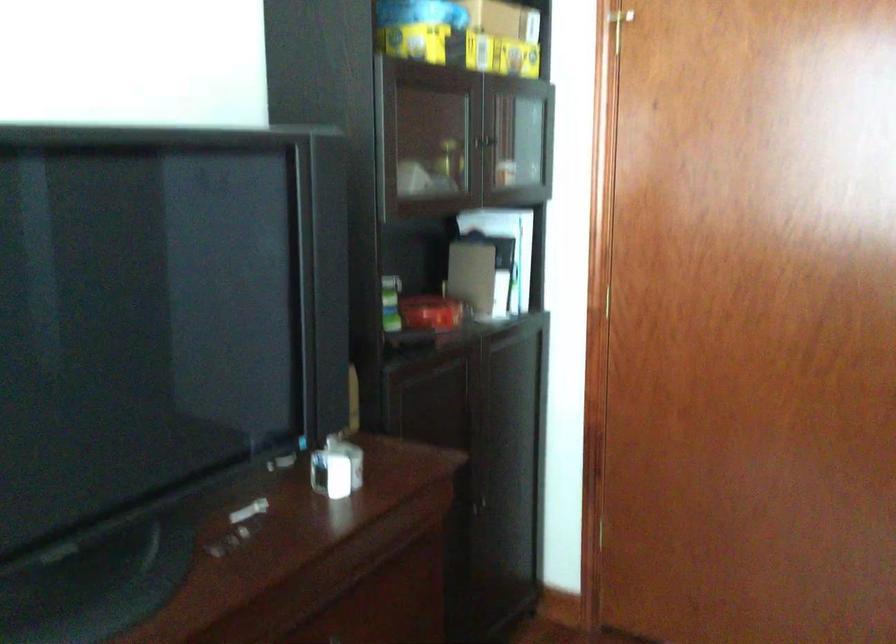
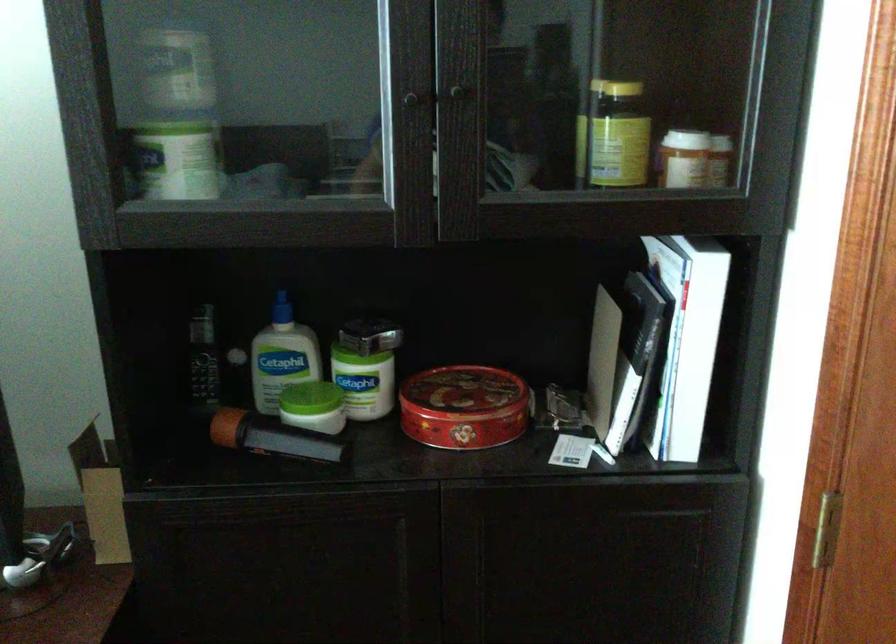
Find the pixel in the second image that matches [427,305] in the first image.

(462, 393)